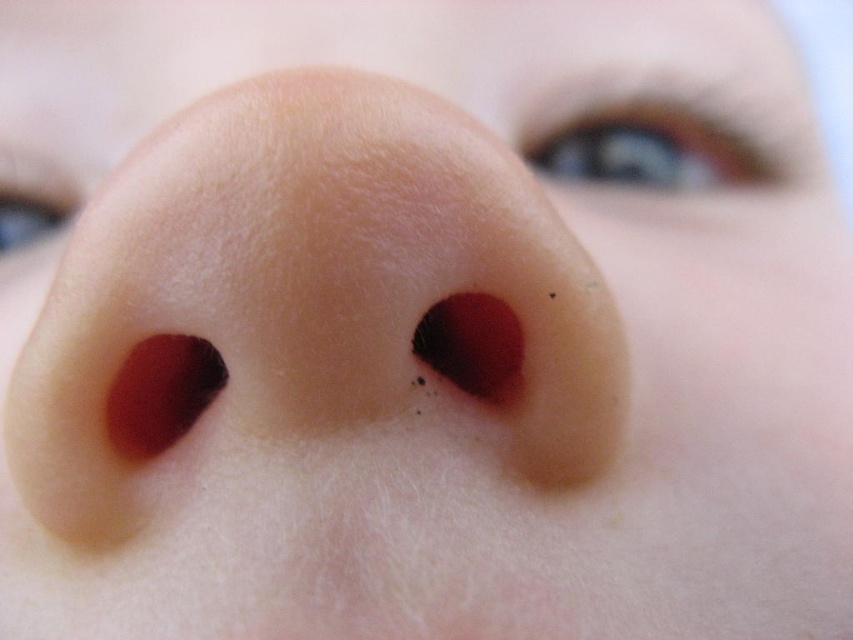
In the scene shown: Does blue glossy eye at upper center lie behind matte blue eye at upper left?

That is True.

Which of these two, blue glossy eye at upper center or matte blue eye at upper left, stands shorter?

Standing shorter between the two is matte blue eye at upper left.

Identify the location of blue glossy eye at upper center. (647, 145).